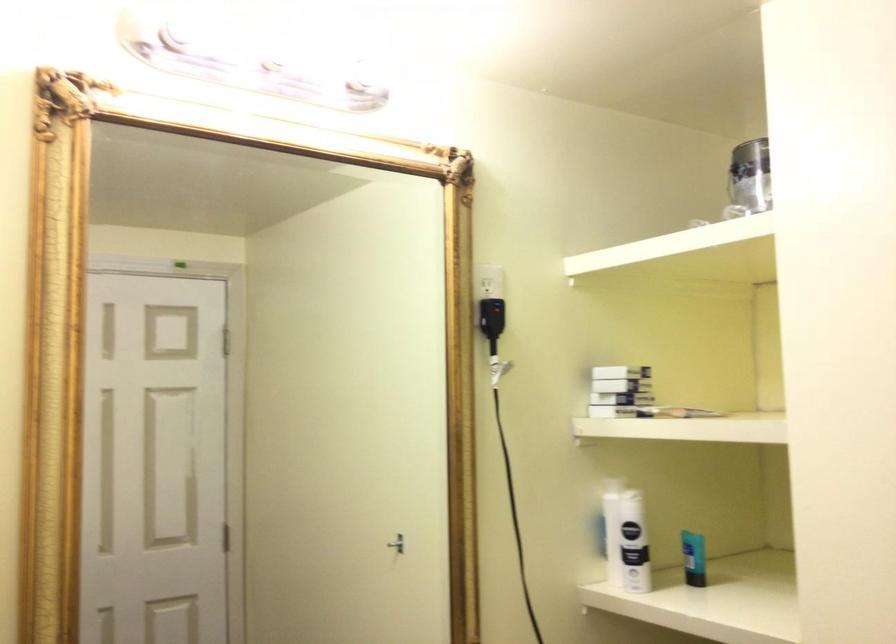
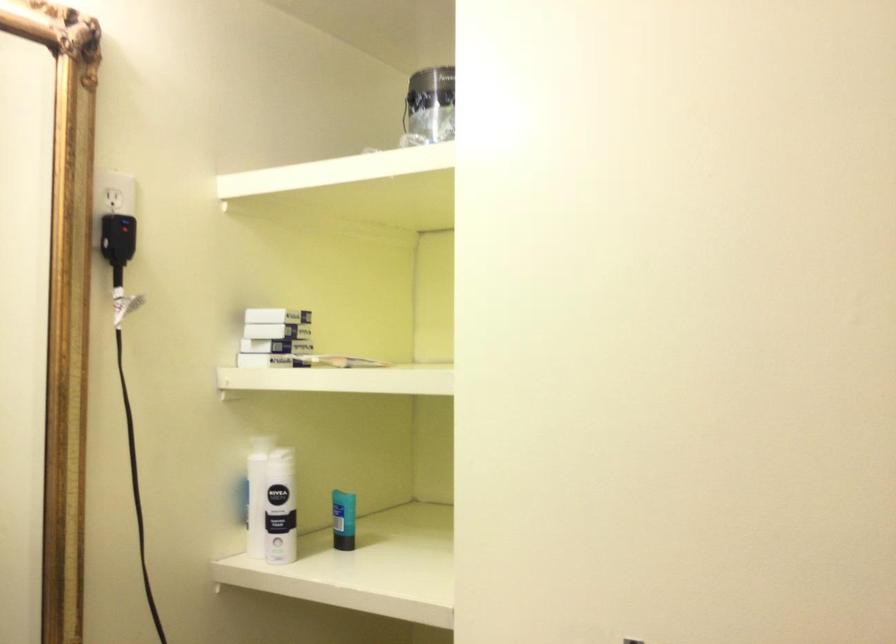
The point at (497, 317) is marked in the first image. Where is the corresponding point in the second image?

(117, 238)